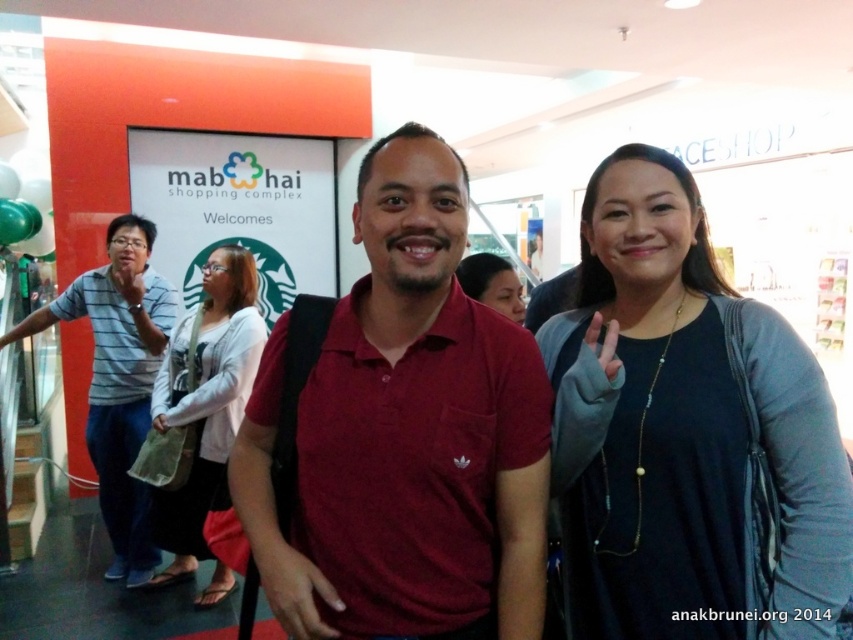
Question: Which object is the farthest from the matte black hair at center?

Choices:
 (A) maroon cotton polo shirt at center
 (B) striped cotton shirt at left
 (C) white cotton shirt at center
 (D) black matte shirt at center

Answer: (B)

Question: Can you confirm if black matte shirt at center is thinner than maroon cotton polo shirt at center?

Choices:
 (A) no
 (B) yes

Answer: (B)

Question: Does black matte shirt at center appear under matte black hair at center?

Choices:
 (A) no
 (B) yes

Answer: (B)

Question: Which point is farther to the camera?

Choices:
 (A) (480, 282)
 (B) (730, 509)
 (C) (397, 216)

Answer: (A)

Question: From the image, what is the correct spatial relationship of black matte shirt at center in relation to striped cotton shirt at left?

Choices:
 (A) right
 (B) left

Answer: (A)

Question: Considering the real-world distances, which object is closest to the matte black hair at center?

Choices:
 (A) striped cotton shirt at left
 (B) maroon cotton polo shirt at center

Answer: (B)